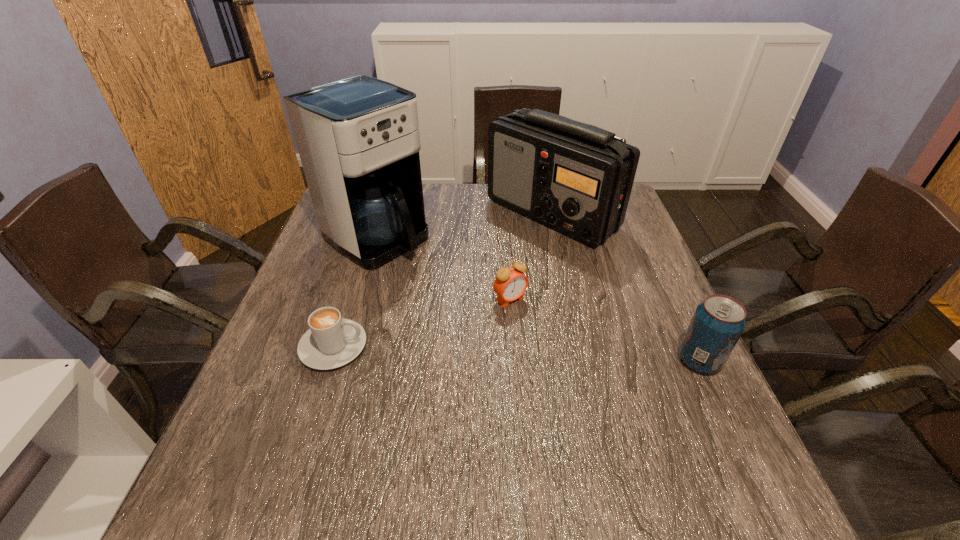
Find the location of a particular element. object that is the second closest one to the coffee maker is located at coordinates (332, 341).

Identify which object is located as the third nearest to the second tallest object. Please provide its 2D coordinates. Your answer should be formatted as a tuple, i.e. [(x, y)], where the tuple contains the x and y coordinates of a point satisfying the conditions above.

[(718, 322)]